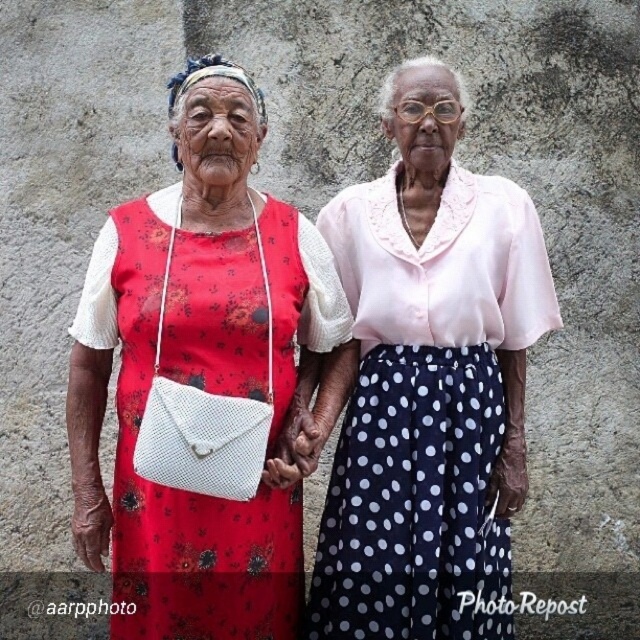
Does dark blue polka dot skirt at center have a greater width compared to red floral fabric dress at left?

Indeed, dark blue polka dot skirt at center has a greater width compared to red floral fabric dress at left.

Who is positioned more to the left, dark blue polka dot skirt at center or red floral fabric dress at left?

red floral fabric dress at left is more to the left.

Which is in front, point (385, 589) or point (141, 624)?

Point (385, 589) is in front.

You are a GUI agent. You are given a task and a screenshot of the screen. Output one action in this format:
    pyautogui.click(x=<x>, y=<y>)
    Task: Click on the dark blue polka dot skirt at center
    
    Given the screenshot: What is the action you would take?
    pyautogui.click(x=426, y=410)

Describe the element at coordinates (307, 369) in the screenshot. I see `matte floral dress at center` at that location.

Who is more forward, (396,120) or (436,248)?

Point (436,248) is more forward.

Is point (257, 605) closer to viewer compared to point (410, 305)?

Yes, it is in front of point (410, 305).

This screenshot has height=640, width=640. I want to click on matte floral dress at center, so click(307, 369).

Does matte floral dress at center have a greater height compared to red floral fabric dress at left?

No, matte floral dress at center is not taller than red floral fabric dress at left.

Does matte floral dress at center appear over red floral fabric dress at left?

No.

In order to click on matte floral dress at center in this screenshot , I will do `click(307, 369)`.